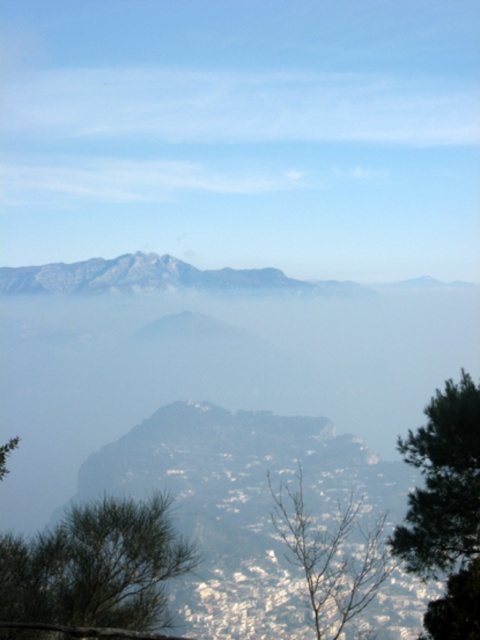
Is green needle-like tree at lower left shorter than green matte tree at right?

No.

Does green needle-like tree at lower left lie in front of green matte tree at right?

Yes.

Does point (52, 589) come in front of point (444, 429)?

That is True.

Locate an element on the screen. The height and width of the screenshot is (640, 480). green needle-like tree at lower left is located at coordinates (96, 566).

What do you see at coordinates (96, 566) in the screenshot?
I see `green needle-like tree at lower left` at bounding box center [96, 566].

Does green needle-like tree at lower left have a smaller size compared to bare branches at lower center?

Correct, green needle-like tree at lower left occupies less space than bare branches at lower center.

Which is in front, point (76, 589) or point (300, 477)?

Point (76, 589)

This screenshot has width=480, height=640. Identify the location of green needle-like tree at lower left. (96, 566).

Does green matte tree at right have a greater height compared to bare branches at lower center?

Incorrect, green matte tree at right's height is not larger of bare branches at lower center's.

Does point (417, 508) come behind point (351, 502)?

That is False.

Is point (478, 520) positioned before point (335, 600)?

Yes, point (478, 520) is in front of point (335, 600).

This screenshot has width=480, height=640. In order to click on green matte tree at right in this screenshot , I will do `click(443, 483)`.